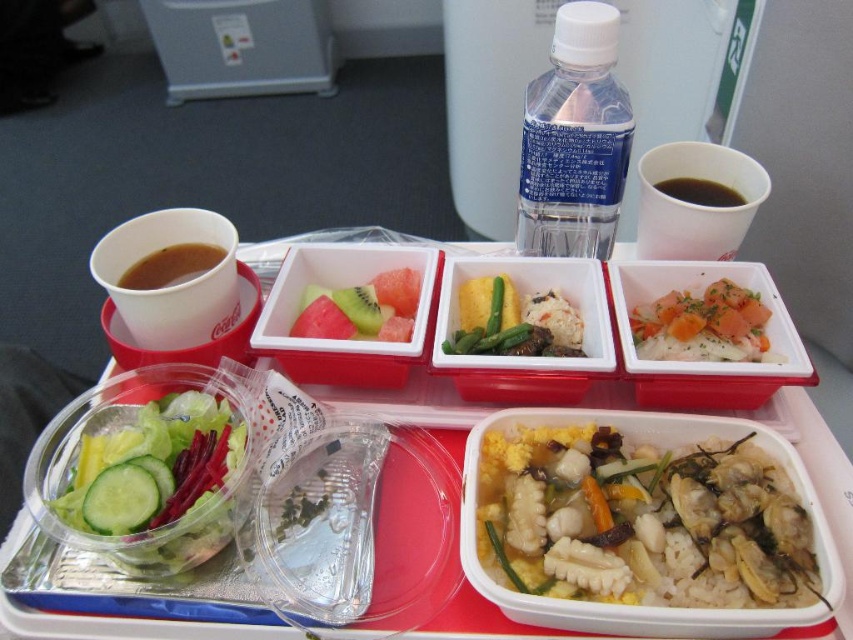
Question: Considering the relative positions of translucent plastic salad bowl at lower left and green matte green beans at center in the image provided, where is translucent plastic salad bowl at lower left located with respect to green matte green beans at center?

Choices:
 (A) left
 (B) right

Answer: (A)

Question: Does green translucent salad at lower left have a smaller size compared to watermelon flesh at center?

Choices:
 (A) no
 (B) yes

Answer: (A)

Question: Which object is the farthest from the green translucent salad at lower left?

Choices:
 (A) translucent plastic salad bowl at lower left
 (B) transparent plastic bottle at upper center

Answer: (B)

Question: Can you confirm if translucent plastic salad bowl at lower left is positioned below black liquid at upper right?

Choices:
 (A) no
 (B) yes

Answer: (B)

Question: Which point is farther to the camera?

Choices:
 (A) (682, 321)
 (B) (555, 355)

Answer: (B)

Question: Which point appears closest to the camera in this image?

Choices:
 (A) (349, 291)
 (B) (714, 204)
 (C) (595, 200)
 (D) (558, 310)

Answer: (D)